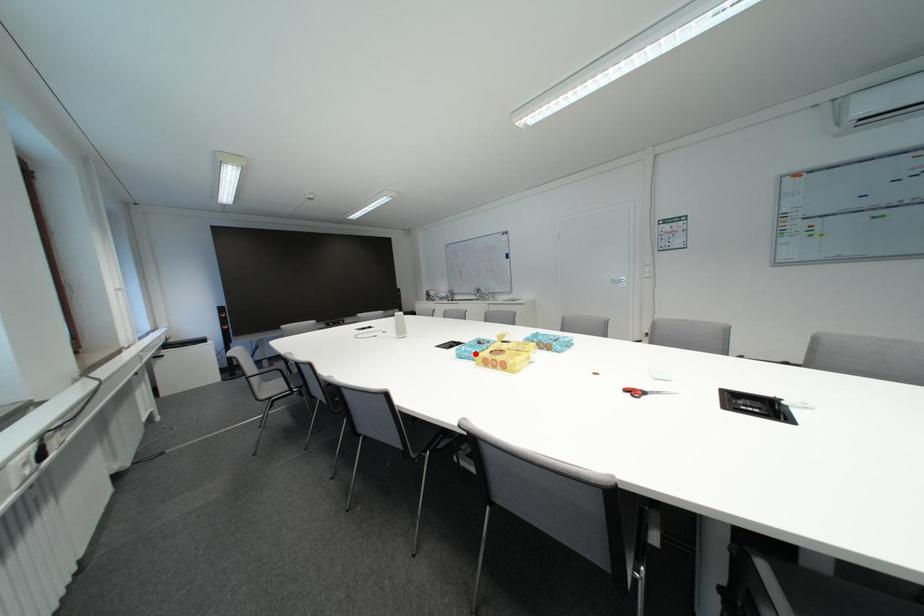
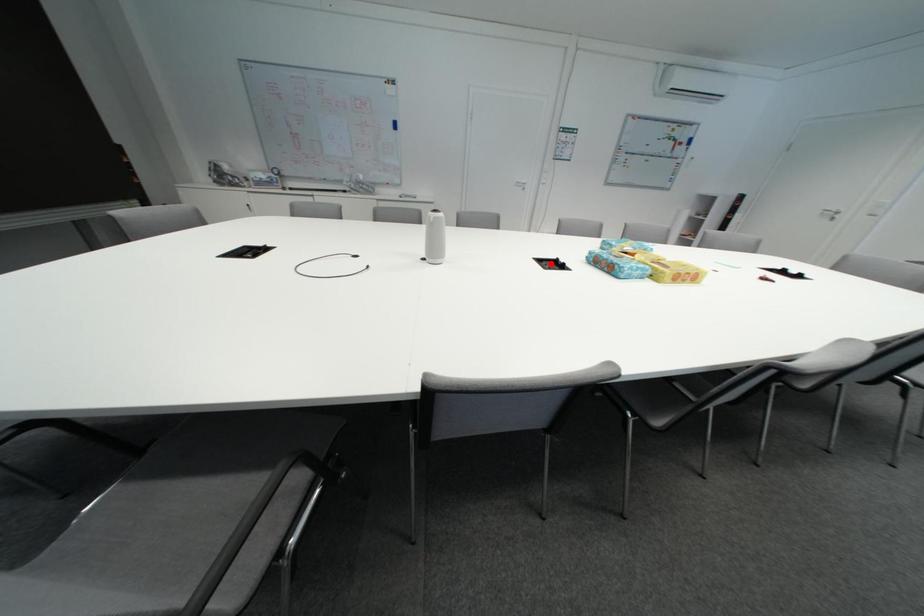
I am providing you with two images of the same scene from different viewpoints. A red point is marked on the first image and another point is marked on the second image. Do the highlighted points in image1 and image2 indicate the same real-world spot?

No